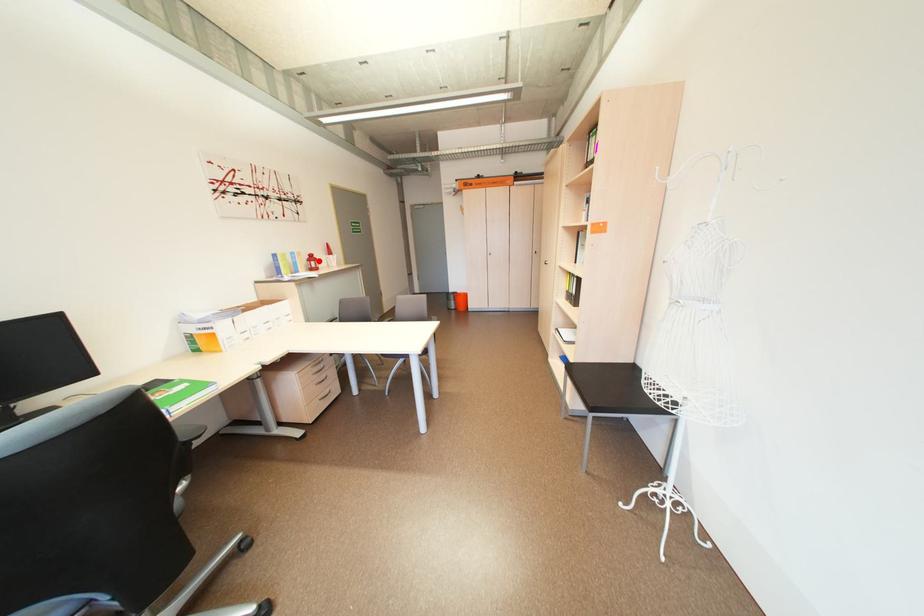
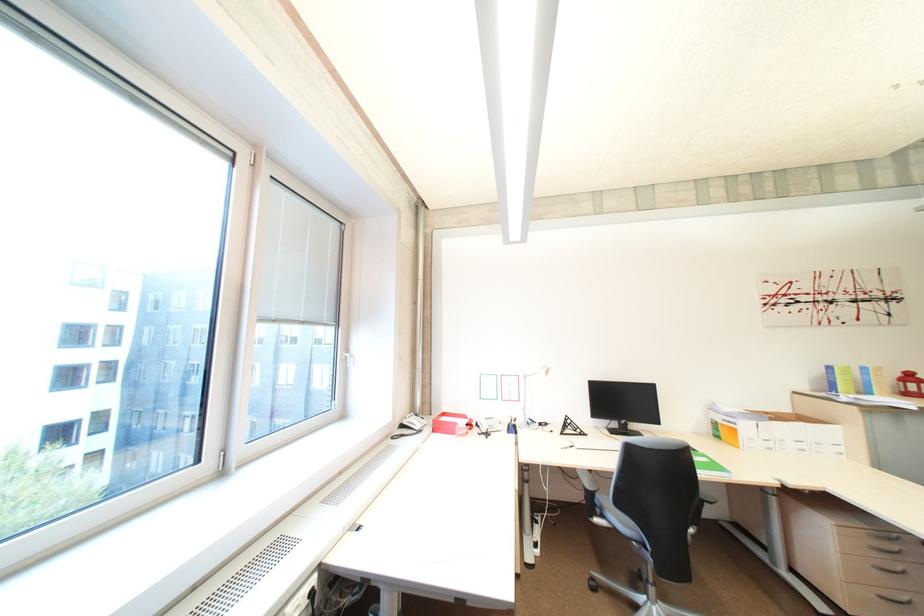
Question: I am providing you with two images of the same scene from different viewpoints. Given a red point in image1, look at the same physical point in image2. Is it:

Choices:
 (A) Closer to the viewpoint
 (B) Farther from the viewpoint

Answer: (A)